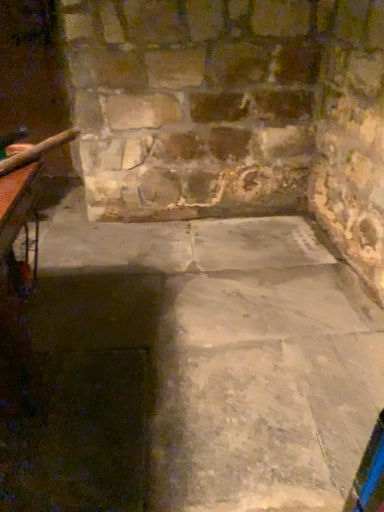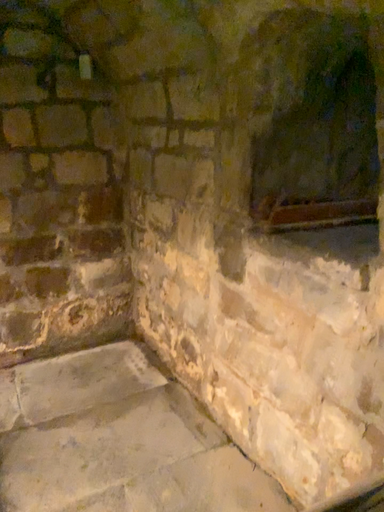
Question: How did the camera likely rotate when shooting the video?

Choices:
 (A) rotated right
 (B) rotated left

Answer: (A)